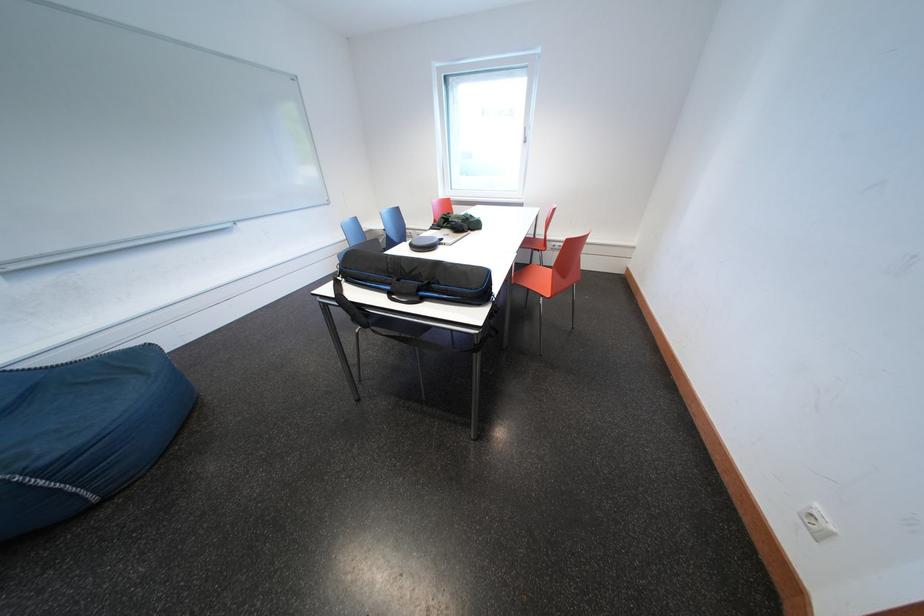
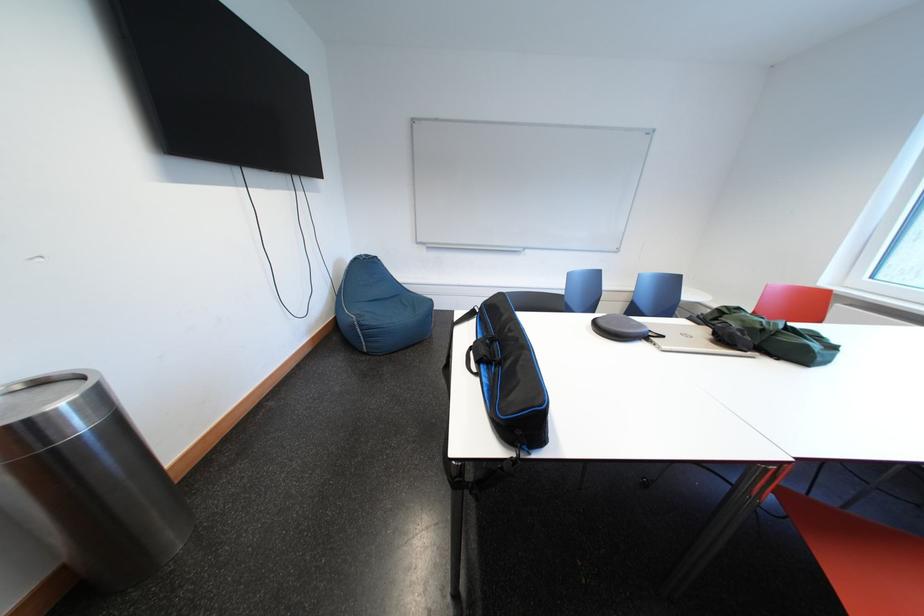
Where in the second image is the point corresponding to pixel 450 246 from the first image?

(657, 341)